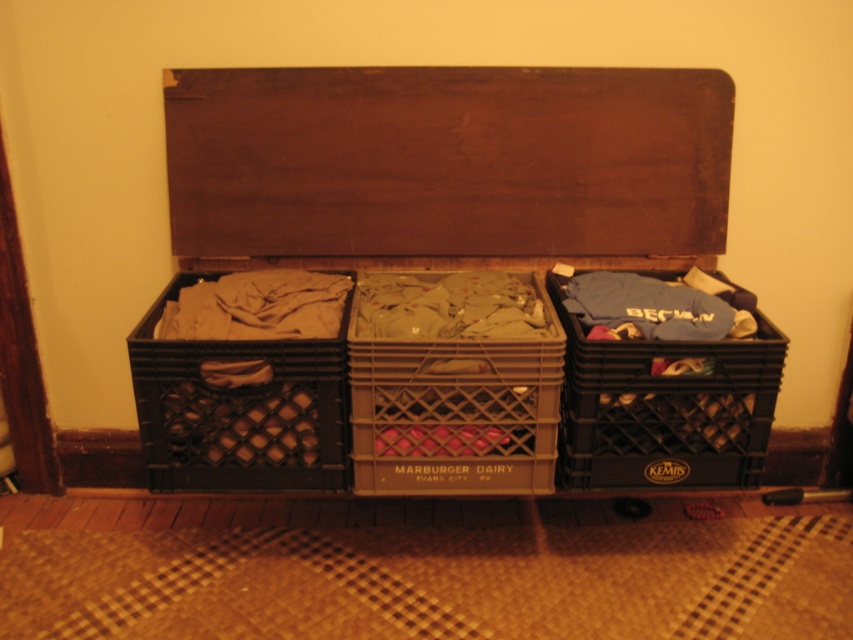
Question: Which of the following is the farthest from the observer?

Choices:
 (A) black plastic crate at left
 (B) blue cotton t-shirt at center right

Answer: (B)

Question: Among these objects, which one is farthest from the camera?

Choices:
 (A) black plastic crate at right
 (B) black plastic crate at center
 (C) blue cotton t-shirt at center right
 (D) black plastic crate at left

Answer: (B)

Question: Does matte plastic crate at center have a larger size compared to black plastic crate at right?

Choices:
 (A) yes
 (B) no

Answer: (A)

Question: Which point is closer to the camera?

Choices:
 (A) black plastic crate at left
 (B) black plastic crate at right
 (C) matte plastic crate at center
 (D) blue cotton t-shirt at center right

Answer: (A)

Question: Can you confirm if black plastic crate at center is smaller than blue cotton t-shirt at center right?

Choices:
 (A) yes
 (B) no

Answer: (B)

Question: Is black plastic crate at center positioned at the back of matte plastic crate at center?

Choices:
 (A) no
 (B) yes

Answer: (B)